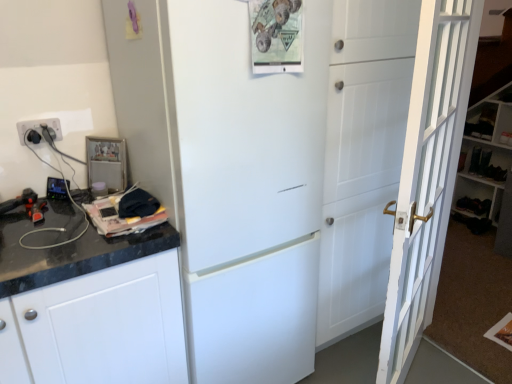
Where is `white wooden bookshelf at right`? This screenshot has width=512, height=384. white wooden bookshelf at right is located at coordinates (485, 157).

Identify the location of metallic photo frame at upper left. (106, 163).

Locate an element on the screen. white wooden door at right is located at coordinates (426, 175).

This screenshot has width=512, height=384. What are the coordinates of `white plastic electrical outlet at left` in the screenshot? It's located at (39, 127).

Identify the location of white matte refrigerator at center. The width and height of the screenshot is (512, 384). (229, 177).

Consider the image. Which is correct: metallic photo frame at upper left is inside white plastic electrical outlet at left, or outside of it?

metallic photo frame at upper left cannot be found inside white plastic electrical outlet at left.

You are a GUI agent. You are given a task and a screenshot of the screen. Output one action in this format:
    pyautogui.click(x=<x>, y=<y>)
    Task: Click on the electric outlet on the left side of metallic photo frame at upper left
    This screenshot has width=512, height=384.
    Given the screenshot: What is the action you would take?
    (39, 127)

Would you consider metallic photo frame at upper left to be distant from white plastic electrical outlet at left?

That's not correct — metallic photo frame at upper left is a little close to white plastic electrical outlet at left.

Is metallic photo frame at upper left positioned behind white plastic electrical outlet at left?

That is True.

What's the angular difference between white plastic electrical outlet at left and white wooden bookshelf at right's facing directions?

white plastic electrical outlet at left and white wooden bookshelf at right are facing 90 degrees away from each other.

Is white plastic electrical outlet at left to the left of white wooden bookshelf at right from the viewer's perspective?

Yes, white plastic electrical outlet at left is to the left of white wooden bookshelf at right.

Is white plastic electrical outlet at left in contact with white wooden bookshelf at right?

No, white plastic electrical outlet at left is not making contact with white wooden bookshelf at right.

Which of these two, white plastic electrical outlet at left or white wooden bookshelf at right, stands shorter?

white plastic electrical outlet at left is shorter.

From their relative heights in the image, would you say white plastic electrical outlet at left is taller or shorter than white matte refrigerator at center?

In the image, white plastic electrical outlet at left appears to be shorter than white matte refrigerator at center.

Where is `electric outlet above the white matte refrigerator at center (from a real-world perspective)`? electric outlet above the white matte refrigerator at center (from a real-world perspective) is located at coordinates (39, 127).

From the image's perspective, which one is positioned higher, white plastic electrical outlet at left or white matte refrigerator at center?

white plastic electrical outlet at left is shown above in the image.

Do you think white wooden bookshelf at right is within white wooden door at right, or outside of it?

white wooden bookshelf at right is located beyond the bounds of white wooden door at right.

Can you see white wooden bookshelf at right touching white wooden door at right?

No, white wooden bookshelf at right is not beside white wooden door at right.

Based on the photo, could you tell me if white wooden bookshelf at right is turned towards white wooden door at right?

No, white wooden bookshelf at right is not facing towards white wooden door at right.

Is white wooden bookshelf at right at the back of metallic photo frame at upper left?

No, metallic photo frame at upper left's orientation is not away from white wooden bookshelf at right.

Is metallic photo frame at upper left in front of or behind white wooden bookshelf at right in the image?

metallic photo frame at upper left is positioned closer to the viewer than white wooden bookshelf at right.

From the image's perspective, who appears lower, metallic photo frame at upper left or white wooden bookshelf at right?

metallic photo frame at upper left, from the image's perspective.

Based on the photo, is white wooden door at right next to white matte refrigerator at center and touching it?

No, white wooden door at right is not next to white matte refrigerator at center.

From the image's perspective, is white wooden door at right located above white matte refrigerator at center?

Actually, white wooden door at right appears below white matte refrigerator at center in the image.

Looking at this image, who is bigger, white wooden door at right or white matte refrigerator at center?

Bigger between the two is white matte refrigerator at center.

Is white wooden door at right facing away from white matte refrigerator at center?

Yes, white wooden door at right's orientation is away from white matte refrigerator at center.

Is point (268, 327) positioned before point (479, 142)?

Yes.

Is white matte refrigerator at center taller than white wooden bookshelf at right?

Yes.

From the picture: Is white matte refrigerator at center positioned beyond the bounds of white wooden bookshelf at right?

Yes, white matte refrigerator at center is not within white wooden bookshelf at right.

Based on the photo, from the image's perspective, does white matte refrigerator at center appear lower than white wooden bookshelf at right?

Yes, from the image's perspective, white matte refrigerator at center is beneath white wooden bookshelf at right.

In order to click on electric outlet above the metallic photo frame at upper left (from the image's perspective) in this screenshot , I will do `click(39, 127)`.

This screenshot has width=512, height=384. Identify the location of bookshelf that is behind the white plastic electrical outlet at left. (485, 157).

Which object lies further to the anchor point white wooden bookshelf at right, metallic photo frame at upper left or white plastic electrical outlet at left?

white plastic electrical outlet at left lies further to white wooden bookshelf at right than the other object.

From the image, which object appears to be nearer to white wooden bookshelf at right, white matte refrigerator at center or white wooden door at right?

Among the two, white wooden door at right is located nearer to white wooden bookshelf at right.

Looking at the image, which one is located closer to white wooden door at right, metallic photo frame at upper left or white wooden bookshelf at right?

metallic photo frame at upper left is positioned closer to the anchor white wooden door at right.

Considering their positions, is white matte refrigerator at center positioned further to white wooden door at right than white wooden bookshelf at right?

Among the two, white wooden bookshelf at right is located further to white wooden door at right.

From the image, which object appears to be farther from white matte refrigerator at center, white wooden door at right or white plastic electrical outlet at left?

Among the two, white plastic electrical outlet at left is located further to white matte refrigerator at center.

Which object lies nearer to the anchor point white matte refrigerator at center, white wooden bookshelf at right or metallic photo frame at upper left?

metallic photo frame at upper left is positioned closer to the anchor white matte refrigerator at center.

Which object lies nearer to the anchor point white wooden door at right, white matte refrigerator at center or metallic photo frame at upper left?

white matte refrigerator at center is closer to white wooden door at right.

Considering their positions, is white plastic electrical outlet at left positioned further to metallic photo frame at upper left than white wooden bookshelf at right?

white wooden bookshelf at right is further to metallic photo frame at upper left.

You are a GUI agent. You are given a task and a screenshot of the screen. Output one action in this format:
    pyautogui.click(x=<x>, y=<y>)
    Task: Click on the refrigerator between white wooden door at right and white wooden bookshelf at right in the front-back direction
    
    Given the screenshot: What is the action you would take?
    pyautogui.click(x=229, y=177)

The height and width of the screenshot is (384, 512). Find the location of `refrigerator between metallic photo frame at upper left and white wooden bookshelf at right`. refrigerator between metallic photo frame at upper left and white wooden bookshelf at right is located at coordinates (229, 177).

Identify the location of door between metallic photo frame at upper left and white wooden bookshelf at right. (426, 175).

At what (x,y) coordinates should I click in order to perform the action: click on appliance between white plastic electrical outlet at left and white matte refrigerator at center in the horizontal direction. Please return your answer as a coordinate pair (x, y). The image size is (512, 384). Looking at the image, I should click on (106, 163).